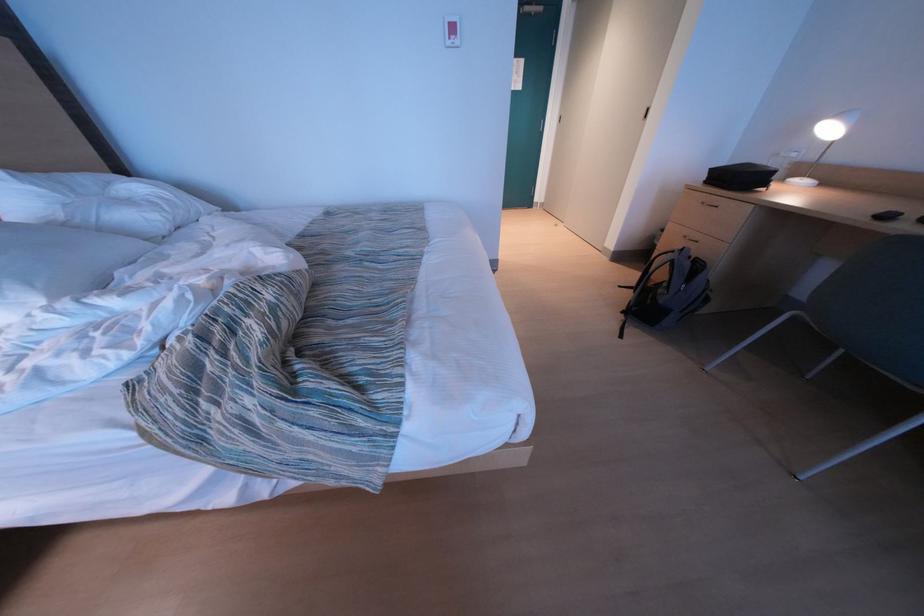
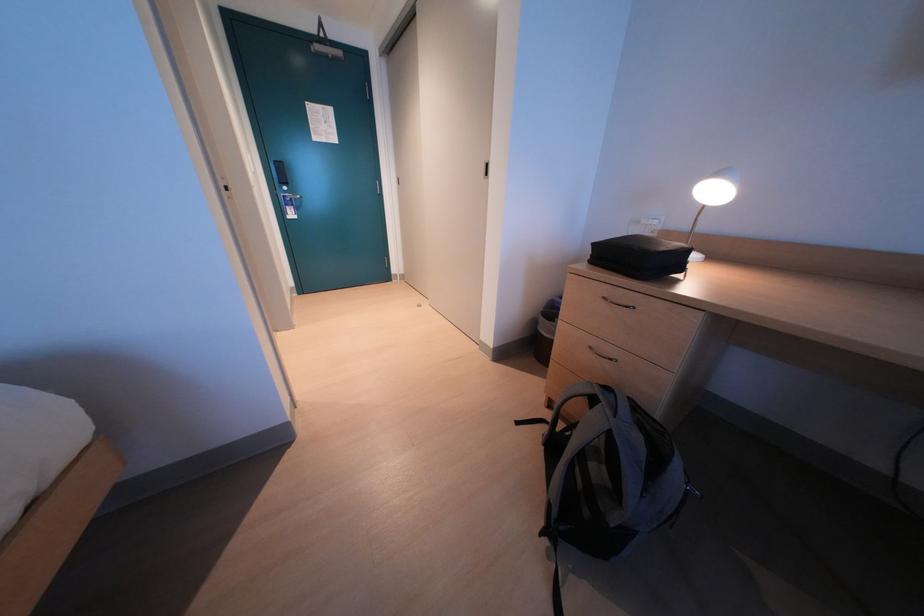
Which direction would the cameraman need to move to produce the second image?

The cameraman walked toward right, forward.